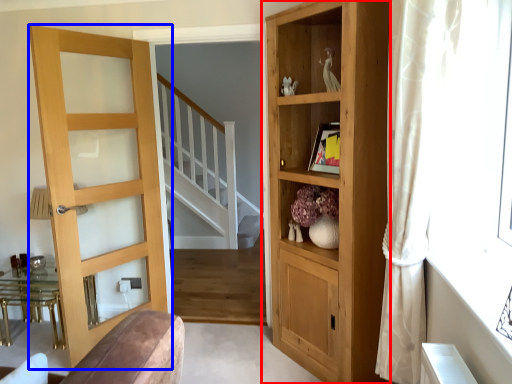
Question: Among these objects, which one is nearest to the camera, cupboard (highlighted by a red box) or door (highlighted by a blue box)?

Choices:
 (A) cupboard
 (B) door

Answer: (A)